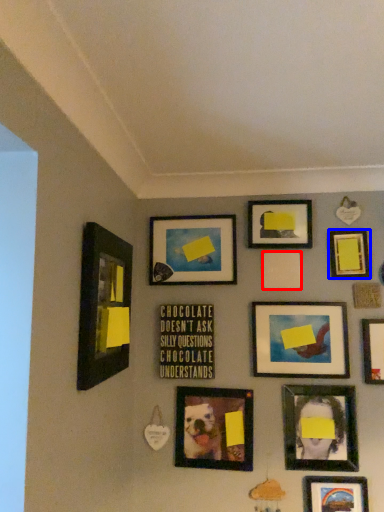
Question: Which object is further to the camera taking this photo, picture frame (highlighted by a red box) or picture frame (highlighted by a blue box)?

Choices:
 (A) picture frame
 (B) picture frame

Answer: (A)